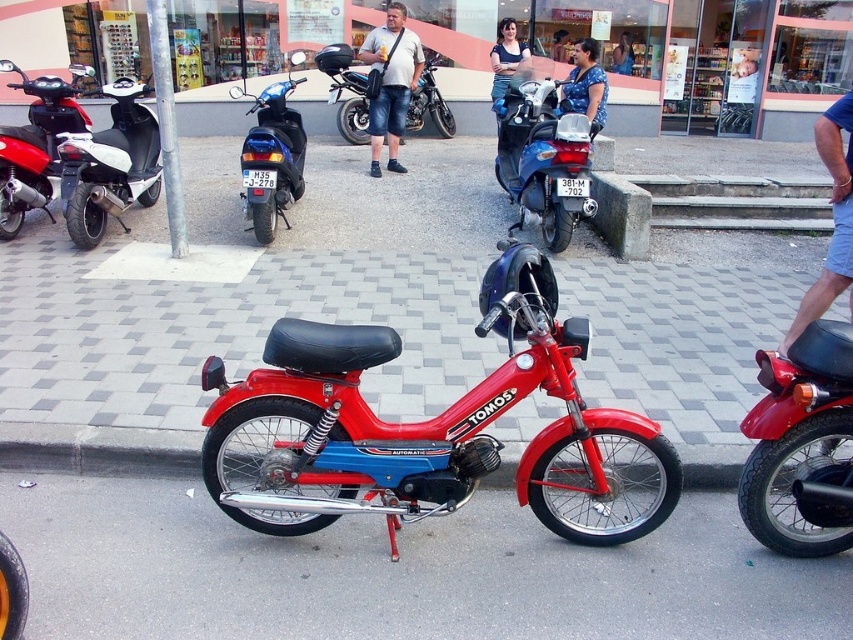
From the picture: You are standing on the sidewalk and want to take a photo of both the shiny red motorcycle at center and the white glossy scooter at left. Which one should you focus on first to ensure both are in focus?

You should focus on the shiny red motorcycle at center first because it is closer to the viewer than the white glossy scooter at left, so adjusting focus from near to far will help both be in focus.

You are standing on the sidewalk and want to cross the street. The smooth asphalt road at center is in front of you. Is the shiny red motorcycle at center closer to you or farther away than the road?

The smooth asphalt road at center is closer to the viewer than the shiny red motorcycle at center, so the motorcycle is farther away than the road.

You are a delivery person who needs to park your scooter between the white glossy scooter at left and the matte black shorts at center. Can you fit your scooter there?

The white glossy scooter at left is to the left of matte black shorts at center, so there is space between them for your scooter.